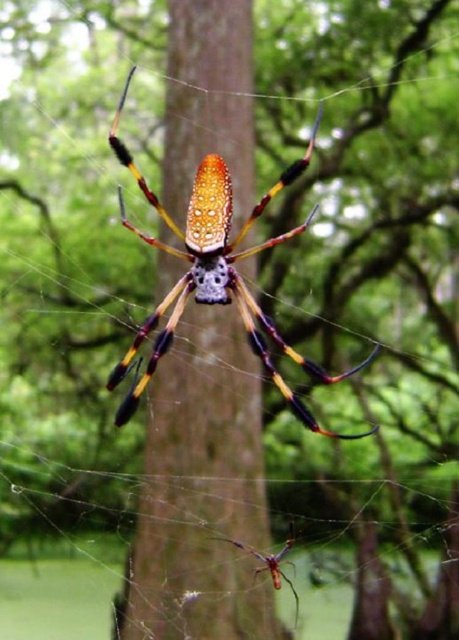
Between brown wood tree trunk at center and shiny metallic spider at center, which one appears on the left side from the viewer's perspective?

brown wood tree trunk at center

Is brown wood tree trunk at center closer to the viewer compared to shiny metallic spider at center?

No.

The image size is (459, 640). What do you see at coordinates (202, 492) in the screenshot?
I see `brown wood tree trunk at center` at bounding box center [202, 492].

The image size is (459, 640). Find the location of `brown wood tree trunk at center`. brown wood tree trunk at center is located at coordinates (202, 492).

Can you confirm if brown wood tree trunk at center is positioned to the left of orange fuzzy spider at center?

Yes, brown wood tree trunk at center is to the left of orange fuzzy spider at center.

Does brown wood tree trunk at center have a smaller size compared to orange fuzzy spider at center?

No.

Locate an element on the screen. brown wood tree trunk at center is located at coordinates (202, 492).

Which of these two, shiny metallic spider at center or orange fuzzy spider at center, stands taller?

Standing taller between the two is shiny metallic spider at center.

Can you confirm if shiny metallic spider at center is shorter than orange fuzzy spider at center?

No, shiny metallic spider at center is not shorter than orange fuzzy spider at center.

Which is in front, point (115, 369) or point (268, 566)?

Point (115, 369) is more forward.

Where is `shiny metallic spider at center`? The height and width of the screenshot is (640, 459). shiny metallic spider at center is located at coordinates (214, 273).